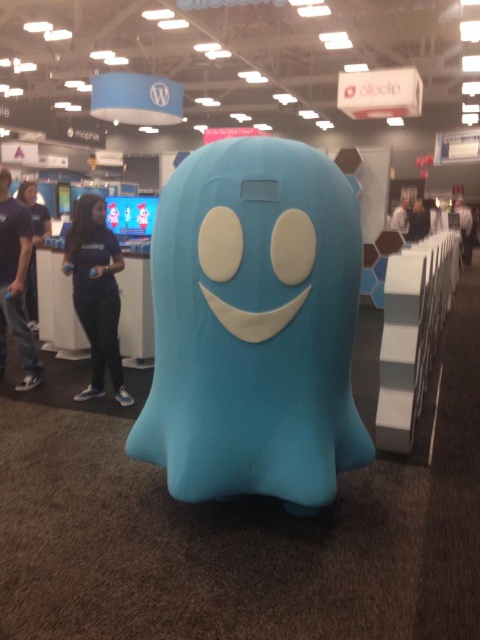
Does blue matte plush toy at left have a larger size compared to dark gray fabric jacket at center?

Yes, blue matte plush toy at left is bigger than dark gray fabric jacket at center.

Does blue matte plush toy at left appear on the right side of dark gray fabric jacket at center?

In fact, blue matte plush toy at left is to the left of dark gray fabric jacket at center.

At what (x,y) coordinates should I click in order to perform the action: click on blue matte plush toy at left. Please return your answer as a coordinate pair (x, y). Looking at the image, I should click on (35, 253).

Does blue matte shirt at left have a lesser width compared to white matte shirt at center?

Result: Yes, blue matte shirt at left is thinner than white matte shirt at center.

Is point (19, 262) positioned after point (403, 196)?

That is False.

This screenshot has width=480, height=640. In order to click on blue matte shirt at left in this screenshot , I will do `click(15, 284)`.

Can you confirm if matte blue plush ghost at center is thinner than blue matte plush toy at left?

In fact, matte blue plush ghost at center might be wider than blue matte plush toy at left.

Is matte blue plush ghost at center positioned before blue matte plush toy at left?

Yes, matte blue plush ghost at center is closer to the viewer.

Identify the location of matte blue plush ghost at center. (253, 326).